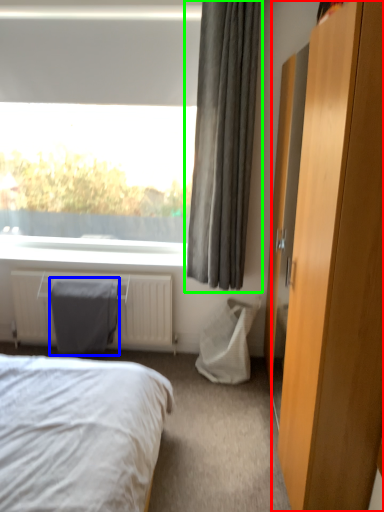
Question: Based on their relative distances, which object is farther from dresser (highlighted by a red box)? Choose from gray (highlighted by a blue box) and curtain (highlighted by a green box).

Choices:
 (A) gray
 (B) curtain

Answer: (A)